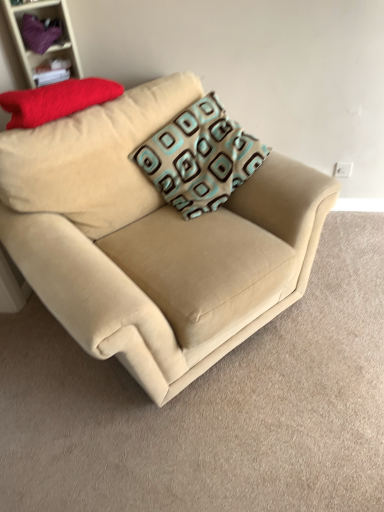
Question: From a real-world perspective, is teal-patterned cushion at center, the 2th pillow viewed from the left, positioned above or below purple fabric at upper left?

Choices:
 (A) below
 (B) above

Answer: (A)

Question: Considering the positions of teal-patterned cushion at center, which is the first pillow from right to left, and purple fabric at upper left in the image, is teal-patterned cushion at center, which is the first pillow from right to left, taller or shorter than purple fabric at upper left?

Choices:
 (A) short
 (B) tall

Answer: (B)

Question: Which of these objects is positioned farthest from the matte red pillow at upper left, acting as the 2th pillow starting from the right?

Choices:
 (A) matte purple fabric at upper left
 (B) teal-patterned cushion at center, which is the first pillow from right to left
 (C) purple fabric at upper left
 (D) beige fabric couch at center

Answer: (D)

Question: Which object is positioned closest to the beige fabric couch at center?

Choices:
 (A) purple fabric at upper left
 (B) matte red pillow at upper left, acting as the 2th pillow starting from the right
 (C) teal-patterned cushion at center, the 2th pillow viewed from the left
 (D) matte purple fabric at upper left

Answer: (C)